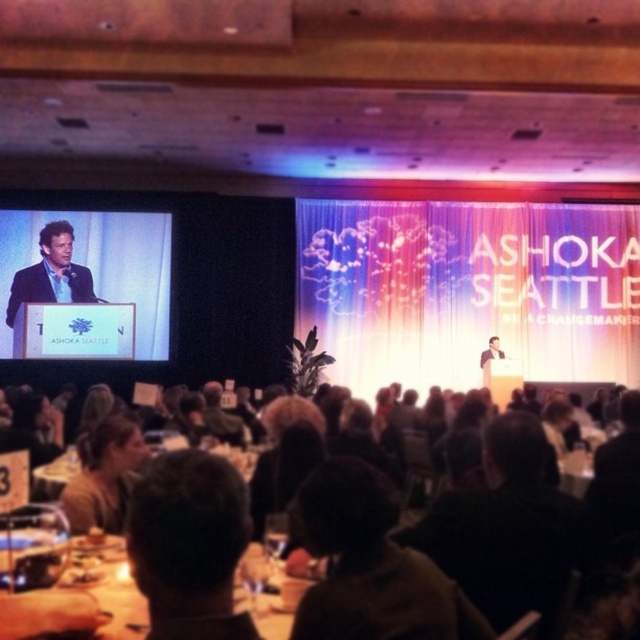
Question: Which object appears farthest from the camera in this image?

Choices:
 (A) brown leather jacket at lower left
 (B) black fabric jacket at center
 (C) dark brown hair at center

Answer: (A)

Question: Does black fabric jacket at center appear on the right side of matte black screen at left?

Choices:
 (A) yes
 (B) no

Answer: (A)

Question: Which object is farther from the camera taking this photo?

Choices:
 (A) matte black screen at left
 (B) dark brown hair at lower center

Answer: (A)

Question: Can you confirm if matte black screen at left is smaller than brown leather jacket at lower left?

Choices:
 (A) no
 (B) yes

Answer: (A)

Question: Among these objects, which one is farthest from the camera?

Choices:
 (A) matte black screen at left
 (B) matte blue shirt at upper left
 (C) dark brown hair at lower center

Answer: (A)

Question: Can you confirm if matte black screen at left is positioned above matte black suit at center?

Choices:
 (A) yes
 (B) no

Answer: (A)